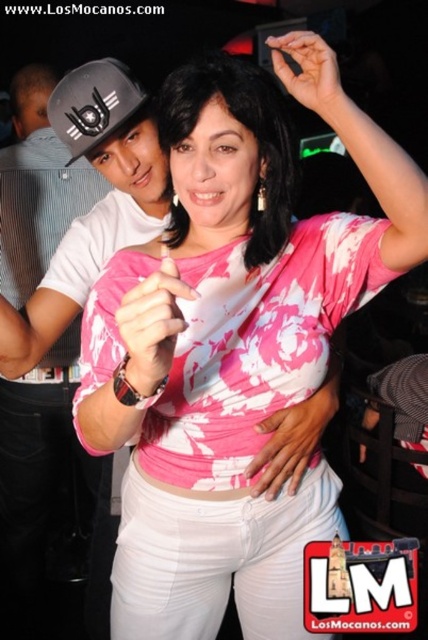
Based on the coordinates provided in the image, which object is located at point (65, 305)?

The point (65, 305) corresponds to the matte white t shirt at upper left.